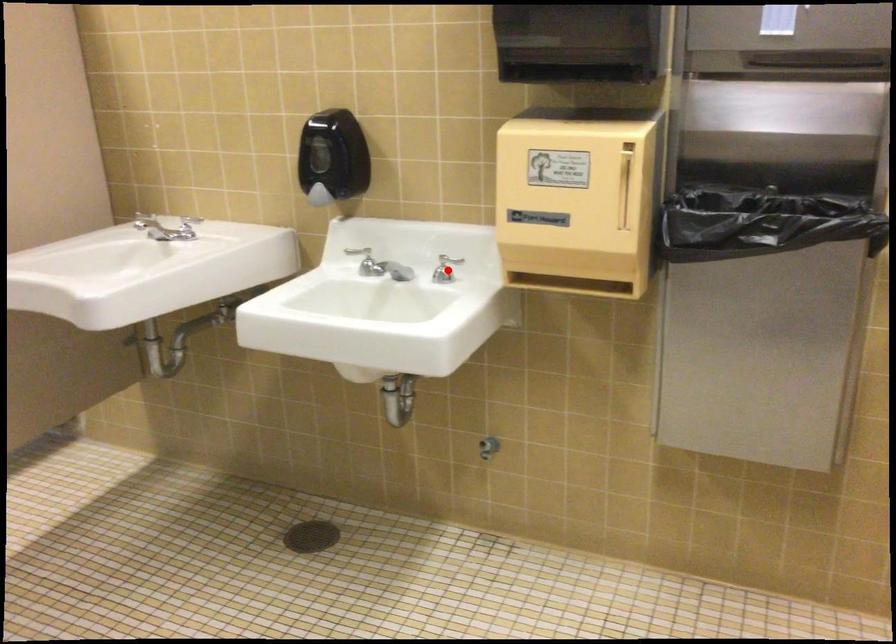
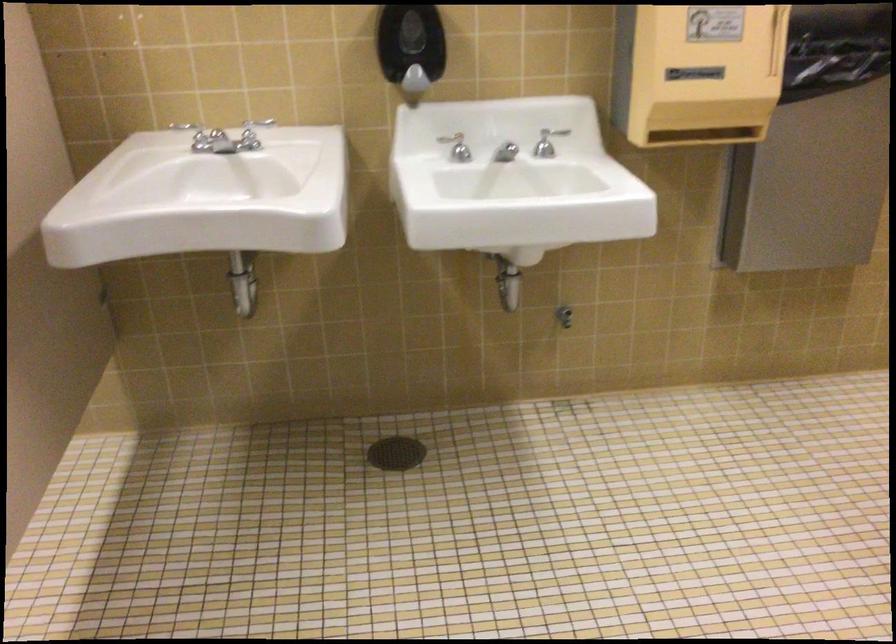
Find the pixel in the second image that matches the highlighted location in the first image.

(547, 142)